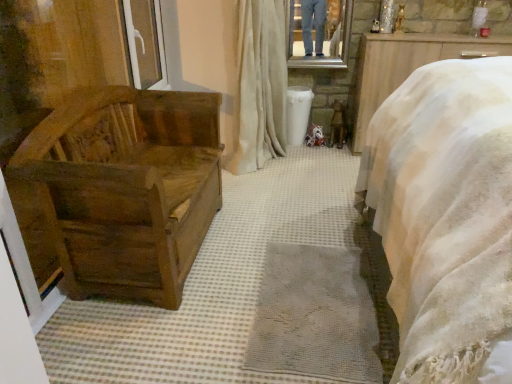
This screenshot has width=512, height=384. In order to click on vacant space to the right of wooden chest at left in this screenshot , I will do `click(294, 266)`.